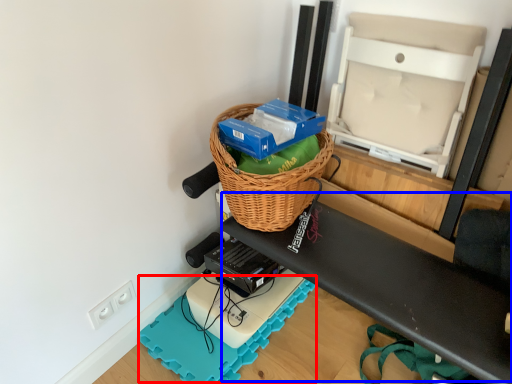
Question: Which of the following is the farthest to the observer, yoga mat (highlighted by a red box) or wide (highlighted by a blue box)?

Choices:
 (A) yoga mat
 (B) wide

Answer: (A)